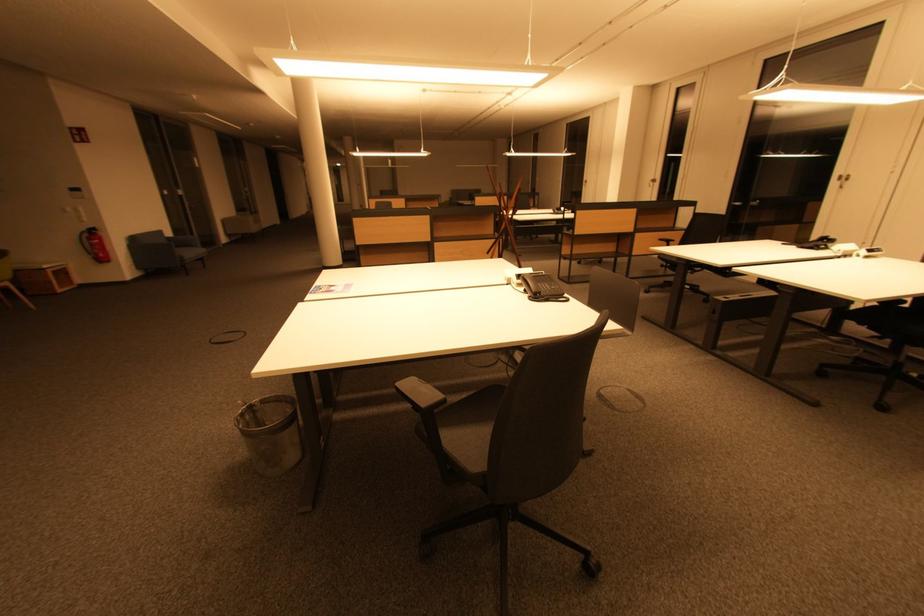
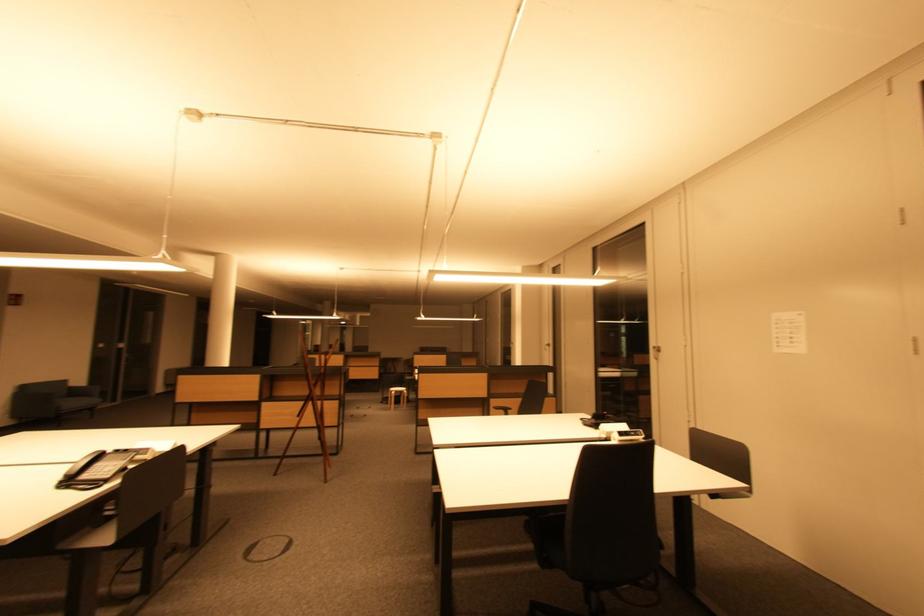
Question: What movement of the cameraman would produce the second image?

Choices:
 (A) Left
 (B) Right
 (C) Forward
 (D) Backward

Answer: (B)